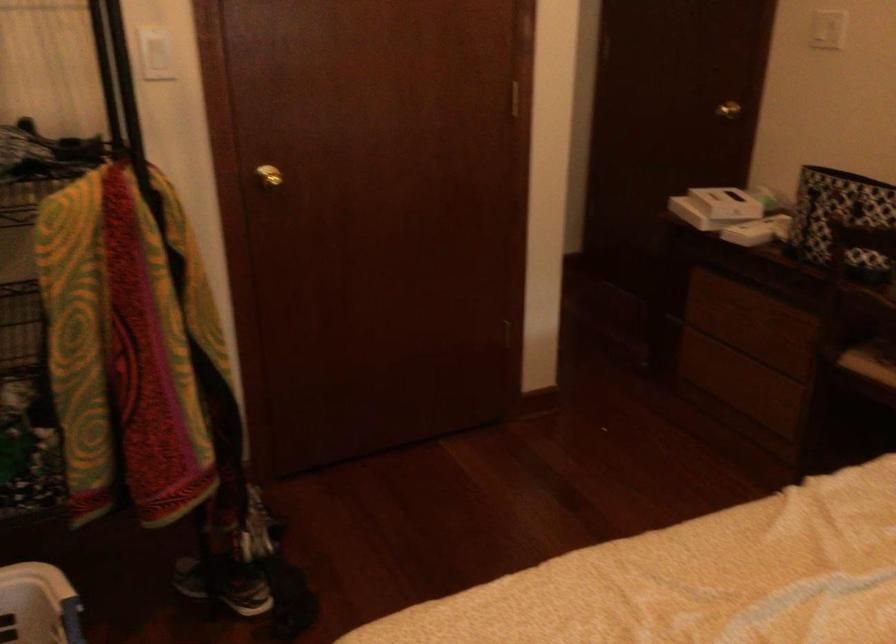
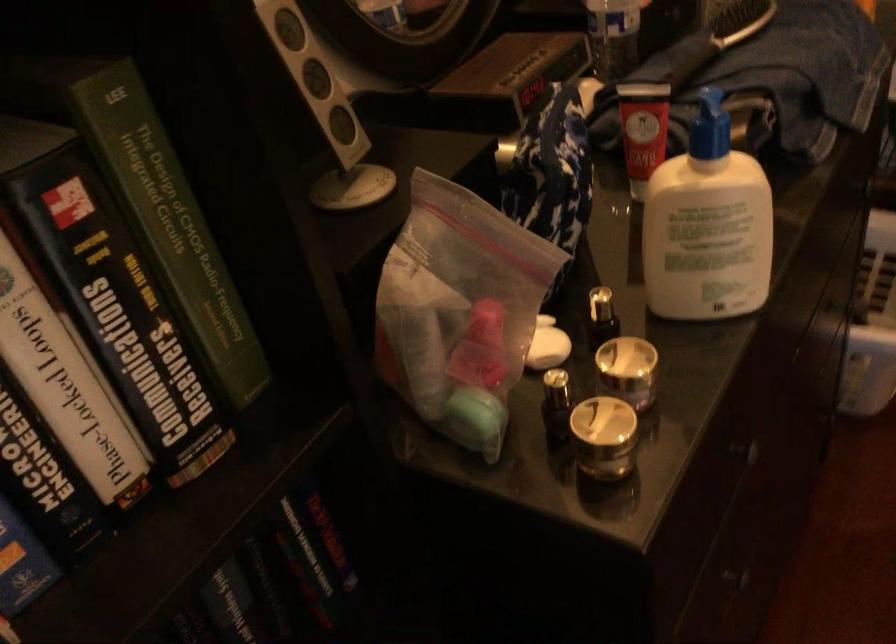
Looking at this image, the images are taken continuously from a first-person perspective. In which direction is your viewpoint rotating?

The rotation direction of the camera is left-down.